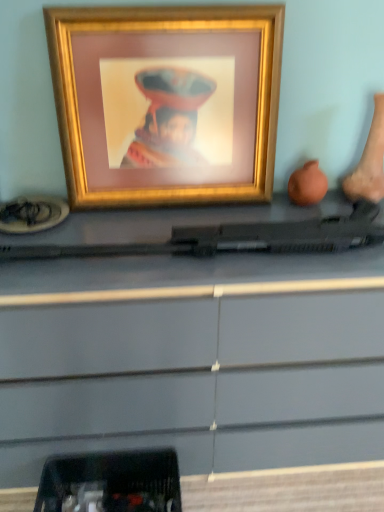
The height and width of the screenshot is (512, 384). Find the location of `empty space that is ontop of matte black gun at center (from a real-world perspective)`. empty space that is ontop of matte black gun at center (from a real-world perspective) is located at coordinates (165, 229).